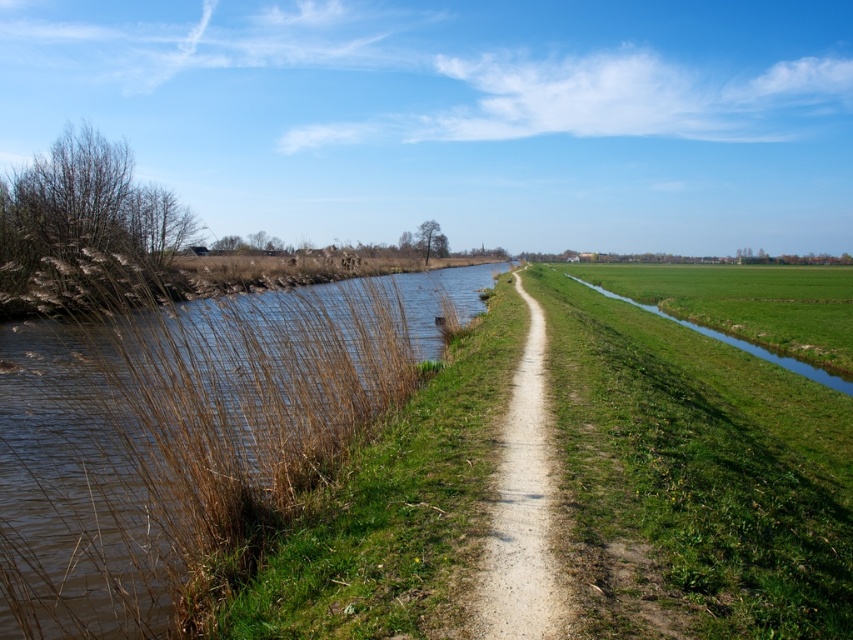
Who is lower down, brown grassy stream at left or green grass at right?

green grass at right

Between brown grassy stream at left and green grass at right, which one has less height?

Standing shorter between the two is brown grassy stream at left.

Describe the element at coordinates (186, 433) in the screenshot. The width and height of the screenshot is (853, 640). I see `brown grassy stream at left` at that location.

I want to click on brown grassy stream at left, so click(186, 433).

Does green grass at right have a greater height compared to dirt/gravel path at center?

Yes.

Between green grass at right and dirt/gravel path at center, which one has more height?

green grass at right is taller.

Who is more distant from viewer, (x=821, y=554) or (x=515, y=524)?

The point (x=821, y=554) is behind.

I want to click on green grass at right, so click(x=694, y=477).

The image size is (853, 640). Find the location of `brown grassy stream at left`. brown grassy stream at left is located at coordinates click(x=186, y=433).

Is point (312, 451) less distant than point (532, 499)?

No, (312, 451) is further to viewer.

Does point (57, 612) come behind point (502, 605)?

Yes, point (57, 612) is farther from viewer.

This screenshot has height=640, width=853. In order to click on brown grassy stream at left in this screenshot , I will do pyautogui.click(x=186, y=433).